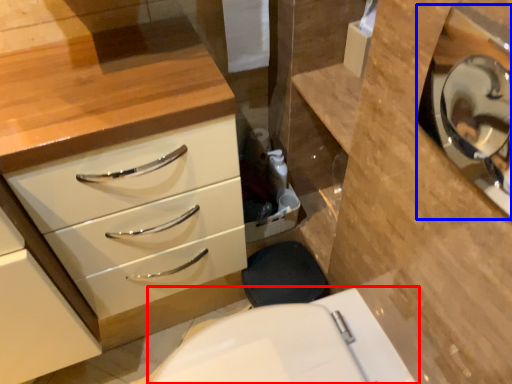
Question: Which of the following is the farthest to the observer, toilet (highlighted by a red box) or medicine cabinet (highlighted by a blue box)?

Choices:
 (A) toilet
 (B) medicine cabinet

Answer: (A)